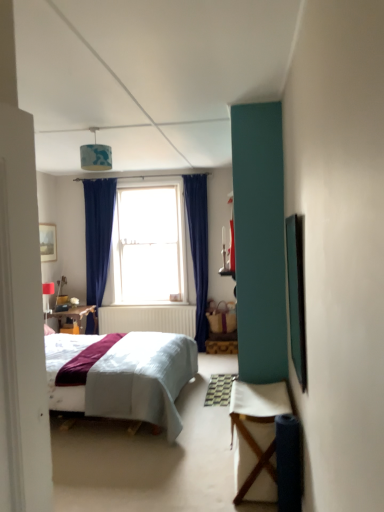
Question: Is clear glass window at center wider than matte white lampshade at upper left, which is the first lamp from left to right?

Choices:
 (A) no
 (B) yes

Answer: (B)

Question: From a real-world perspective, is clear glass window at center beneath matte white lampshade at upper left, which is counted as the second lamp, starting from the top?

Choices:
 (A) yes
 (B) no

Answer: (B)

Question: From the image's perspective, does clear glass window at center appear lower than matte white lampshade at upper left, which is counted as the second lamp, starting from the top?

Choices:
 (A) yes
 (B) no

Answer: (B)

Question: Is the depth of clear glass window at center greater than that of matte white lampshade at upper left, acting as the 1th lamp starting from the bottom?

Choices:
 (A) no
 (B) yes

Answer: (B)

Question: Can you confirm if clear glass window at center is taller than matte white lampshade at upper left, which is the 2th lamp from front to back?

Choices:
 (A) no
 (B) yes

Answer: (B)

Question: Visually, is blue fabric lampshade at upper center, which is counted as the first lamp, starting from the front, positioned to the left or to the right of matte white lampshade at upper left, which is the 2th lamp from front to back?

Choices:
 (A) right
 (B) left

Answer: (A)

Question: In the image, is blue fabric lampshade at upper center, which is counted as the first lamp, starting from the front, positioned in front of or behind matte white lampshade at upper left, which is the first lamp from left to right?

Choices:
 (A) behind
 (B) front

Answer: (B)

Question: Is point (104, 147) closer or farther from the camera than point (48, 285)?

Choices:
 (A) farther
 (B) closer

Answer: (B)

Question: Looking at their shapes, would you say blue fabric lampshade at upper center, which is counted as the first lamp, starting from the front, is wider or thinner than matte white lampshade at upper left, the first lamp positioned from the back?

Choices:
 (A) wide
 (B) thin

Answer: (A)

Question: In the image, is wooden framed picture at upper left on the left side or the right side of clear glass window at center?

Choices:
 (A) right
 (B) left

Answer: (B)

Question: Is wooden framed picture at upper left wider or thinner than clear glass window at center?

Choices:
 (A) thin
 (B) wide

Answer: (A)

Question: Is wooden framed picture at upper left bigger or smaller than clear glass window at center?

Choices:
 (A) small
 (B) big

Answer: (A)

Question: From their relative heights in the image, would you say wooden framed picture at upper left is taller or shorter than clear glass window at center?

Choices:
 (A) short
 (B) tall

Answer: (A)

Question: Relative to clear glass window at center, is matte white lampshade at upper left, acting as the 1th lamp starting from the bottom, in front or behind?

Choices:
 (A) behind
 (B) front

Answer: (B)

Question: Is point (44, 294) closer or farther from the camera than point (117, 284)?

Choices:
 (A) farther
 (B) closer

Answer: (B)